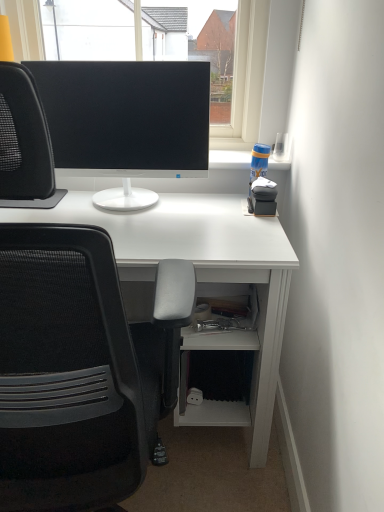
Question: From a real-world perspective, is matte black monitor at center positioned over black matte monitor at upper center based on gravity?

Choices:
 (A) yes
 (B) no

Answer: (B)

Question: Can you confirm if matte black monitor at center is wider than black matte monitor at upper center?

Choices:
 (A) yes
 (B) no

Answer: (B)

Question: Is matte black monitor at center positioned behind black matte monitor at upper center?

Choices:
 (A) no
 (B) yes

Answer: (A)

Question: Is matte black monitor at center not inside black matte monitor at upper center?

Choices:
 (A) yes
 (B) no

Answer: (A)

Question: From a real-world perspective, is matte black monitor at center physically below black matte monitor at upper center?

Choices:
 (A) yes
 (B) no

Answer: (A)

Question: Is matte black monitor at center oriented away from black matte monitor at upper center?

Choices:
 (A) yes
 (B) no

Answer: (A)

Question: From the image's perspective, is matte black monitor at center on top of black mesh chair at left?

Choices:
 (A) no
 (B) yes

Answer: (B)

Question: Considering the relative positions of matte black monitor at center and black mesh chair at left in the image provided, is matte black monitor at center to the left of black mesh chair at left from the viewer's perspective?

Choices:
 (A) no
 (B) yes

Answer: (A)

Question: Does matte black monitor at center contain black mesh chair at left?

Choices:
 (A) yes
 (B) no

Answer: (B)

Question: Are matte black monitor at center and black mesh chair at left beside each other?

Choices:
 (A) no
 (B) yes

Answer: (A)

Question: Does matte black monitor at center appear on the right side of black mesh chair at left?

Choices:
 (A) no
 (B) yes

Answer: (B)

Question: Can you confirm if matte black monitor at center is wider than black mesh chair at left?

Choices:
 (A) no
 (B) yes

Answer: (A)

Question: Is black matte monitor at upper center smaller than black mesh chair at left?

Choices:
 (A) no
 (B) yes

Answer: (B)